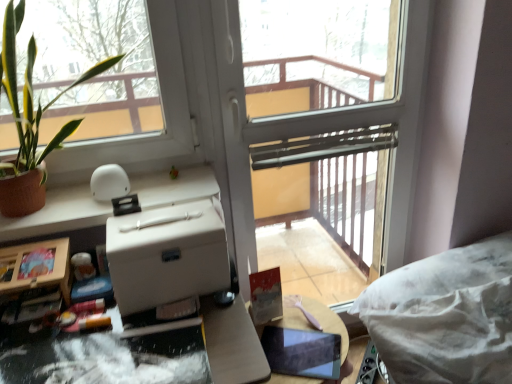
This screenshot has width=512, height=384. Describe the element at coordinates (328, 322) in the screenshot. I see `wooden round table at center` at that location.

In order to face transparent glass screen door at center, should I rotate leftwards or rightwards?

Turn right approximately 10.037 degrees to face it.

Image resolution: width=512 pixels, height=384 pixels. What are the coordinates of `green leafy plant at left` in the screenshot? It's located at 30,122.

Considering the positions of objects transparent glass screen door at center and white matte cardboard box at center in the image provided, who is more to the right, transparent glass screen door at center or white matte cardboard box at center?

Positioned to the right is transparent glass screen door at center.

Is transparent glass screen door at center looking in the opposite direction of white matte cardboard box at center?

transparent glass screen door at center is not turned away from white matte cardboard box at center.

Is transparent glass screen door at center inside or outside of white matte cardboard box at center?

transparent glass screen door at center is not enclosed by white matte cardboard box at center.

From the picture: Between transparent glass screen door at center and white matte cardboard box at center, which one has smaller width?

With smaller width is transparent glass screen door at center.

Considering the sizes of objects green leafy plant at left and white matte cardboard box at center in the image provided, who is bigger, green leafy plant at left or white matte cardboard box at center?

Bigger between the two is green leafy plant at left.

From the picture: Is green leafy plant at left behind white matte cardboard box at center?

No, green leafy plant at left is closer to the viewer.

Is green leafy plant at left not inside white matte cardboard box at center?

Indeed, green leafy plant at left is completely outside white matte cardboard box at center.

Find the location of a particular element. This screenshot has width=512, height=384. houseplant lying above the white matte cardboard box at center (from the image's perspective) is located at coordinates (30, 122).

Can you confirm if white matte cardboard box at center is smaller than green leafy plant at left?

Correct, white matte cardboard box at center occupies less space than green leafy plant at left.

Can green leafy plant at left be found inside white matte cardboard box at center?

That's incorrect, green leafy plant at left is not inside white matte cardboard box at center.

What's the angular difference between white matte cardboard box at center and green leafy plant at left's facing directions?

The angular difference between white matte cardboard box at center and green leafy plant at left is 3.84 degrees.

Which of these two, white matte cardboard box at center or green leafy plant at left, stands taller?

With more height is green leafy plant at left.

From the image's perspective, would you say green leafy plant at left is positioned over white matte counter top at upper left?

Yes, from the image's perspective, green leafy plant at left is on top of white matte counter top at upper left.

Considering the relative sizes of green leafy plant at left and white matte counter top at upper left in the image provided, is green leafy plant at left taller than white matte counter top at upper left?

Yes.

Measure the distance from green leafy plant at left to white matte counter top at upper left.

The distance of green leafy plant at left from white matte counter top at upper left is 8.84 inches.

Is green leafy plant at left not near white matte counter top at upper left?

green leafy plant at left is near white matte counter top at upper left, not far away.

Considering the positions of objects wooden round table at center and white matte cardboard box at center in the image provided, who is more to the left, wooden round table at center or white matte cardboard box at center?

white matte cardboard box at center.

Can you tell me how much wooden round table at center and white matte cardboard box at center differ in facing direction?

The angular difference between wooden round table at center and white matte cardboard box at center is 2.59 degrees.

Is wooden round table at center situated inside white matte cardboard box at center or outside?

wooden round table at center is located beyond the bounds of white matte cardboard box at center.

Could you tell me if wooden round table at center is turned towards white matte cardboard box at center?

No, wooden round table at center is not aimed at white matte cardboard box at center.

Who is bigger, white matte cardboard box at center or transparent glass screen door at center?

With larger size is transparent glass screen door at center.

The width and height of the screenshot is (512, 384). What are the coordinates of `screen door below the white matte cardboard box at center (from a real-world perspective)` in the screenshot? It's located at (268, 129).

Relative to transparent glass screen door at center, is white matte cardboard box at center in front or behind?

white matte cardboard box at center is positioned closer to the viewer than transparent glass screen door at center.

In the scene shown: Who is taller, white matte cardboard box at center or transparent glass screen door at center?

Standing taller between the two is transparent glass screen door at center.

Looking at this image, does white matte counter top at upper left have a lesser width compared to transparent glass screen door at center?

In fact, white matte counter top at upper left might be wider than transparent glass screen door at center.

Is white matte counter top at upper left in contact with transparent glass screen door at center?

white matte counter top at upper left and transparent glass screen door at center are clearly separated.

Is white matte counter top at upper left oriented towards transparent glass screen door at center?

No, white matte counter top at upper left does not turn towards transparent glass screen door at center.

In terms of height, does white matte counter top at upper left look taller or shorter compared to transparent glass screen door at center?

Considering their sizes, white matte counter top at upper left has less height than transparent glass screen door at center.

Locate an element on the screen. This screenshot has width=512, height=384. cardboard box below the transparent glass screen door at center (from the image's perspective) is located at coordinates (167, 255).

Where is `cardboard box that is behind the green leafy plant at left`? Image resolution: width=512 pixels, height=384 pixels. cardboard box that is behind the green leafy plant at left is located at coordinates (167, 255).

Estimate the real-world distances between objects in this image. Which object is closer to wooden round table at center, transparent glass screen door at center or white matte counter top at upper left?

transparent glass screen door at center lies closer to wooden round table at center than the other object.

Considering their positions, is wooden round table at center positioned further to transparent glass screen door at center than white matte counter top at upper left?

wooden round table at center.

Estimate the real-world distances between objects in this image. Which object is further from white matte counter top at upper left, white matte cardboard box at center or transparent glass screen door at center?

transparent glass screen door at center is further to white matte counter top at upper left.

Looking at the image, which one is located closer to green leafy plant at left, white matte counter top at upper left or transparent glass screen door at center?

white matte counter top at upper left is closer to green leafy plant at left.

Which object lies nearer to the anchor point transparent glass screen door at center, white matte cardboard box at center or wooden round table at center?

wooden round table at center is closer to transparent glass screen door at center.

From the image, which object appears to be nearer to white matte cardboard box at center, green leafy plant at left or white matte counter top at upper left?

Among the two, white matte counter top at upper left is located nearer to white matte cardboard box at center.

Estimate the real-world distances between objects in this image. Which object is further from white matte cardboard box at center, green leafy plant at left or transparent glass screen door at center?

Among the two, transparent glass screen door at center is located further to white matte cardboard box at center.

Considering their positions, is wooden round table at center positioned closer to white matte cardboard box at center than green leafy plant at left?

green leafy plant at left is closer to white matte cardboard box at center.

In order to click on cardboard box between white matte counter top at upper left and wooden round table at center from top to bottom in this screenshot , I will do `click(167, 255)`.

Find the location of a particular element. This screenshot has width=512, height=384. counter top that lies between green leafy plant at left and white matte cardboard box at center from top to bottom is located at coordinates (58, 215).

I want to click on counter top between green leafy plant at left and wooden round table at center in the up-down direction, so click(58, 215).

Find the location of a particular element. The image size is (512, 384). cardboard box between green leafy plant at left and wooden round table at center in the vertical direction is located at coordinates click(x=167, y=255).